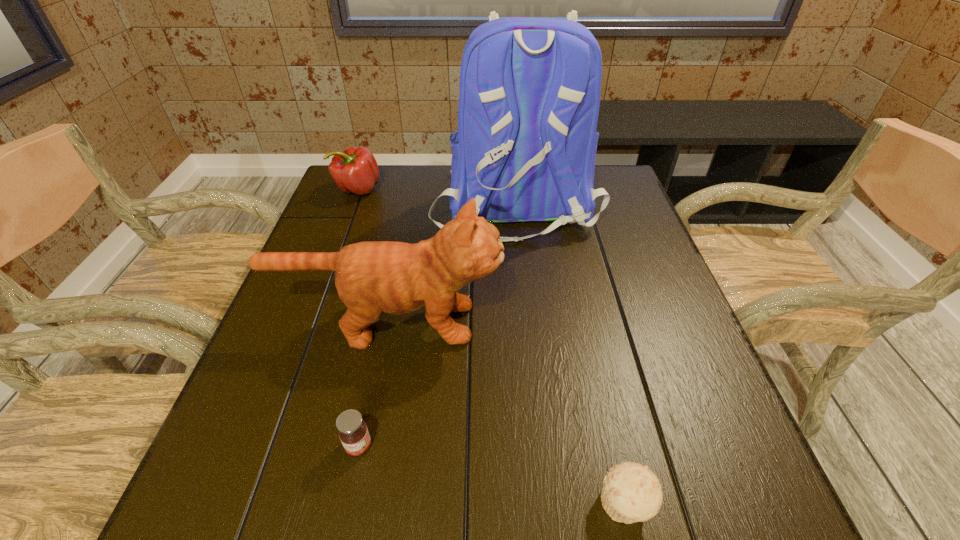
The width and height of the screenshot is (960, 540). Identify the location of vacant space at the near edge of the desktop. (538, 504).

In the image, there is a desktop. Find the location of `free space at the left edge`. free space at the left edge is located at coordinates (348, 226).

In the image, there is a desktop. Where is `vacant space at the right edge`? This screenshot has width=960, height=540. vacant space at the right edge is located at coordinates (649, 385).

The height and width of the screenshot is (540, 960). What are the coordinates of `free space at the far left corner of the desktop` in the screenshot? It's located at (341, 197).

In the image, there is a desktop. Where is `vacant space at the near right corner`? The image size is (960, 540). vacant space at the near right corner is located at coordinates (x=718, y=485).

Where is `vacant space in between the second tallest object and the jam`? The width and height of the screenshot is (960, 540). vacant space in between the second tallest object and the jam is located at coordinates (373, 384).

Identify the location of unoccupied area between the jam and the cat. (373, 384).

Where is `free point between the second nearest object and the nearest object`? This screenshot has height=540, width=960. free point between the second nearest object and the nearest object is located at coordinates (492, 475).

The width and height of the screenshot is (960, 540). I want to click on unoccupied area between the third shortest object and the backpack, so click(x=436, y=198).

At what (x,y) coordinates should I click in order to perform the action: click on free point between the jam and the second tallest object. Please return your answer as a coordinate pair (x, y). The height and width of the screenshot is (540, 960). Looking at the image, I should click on (373, 384).